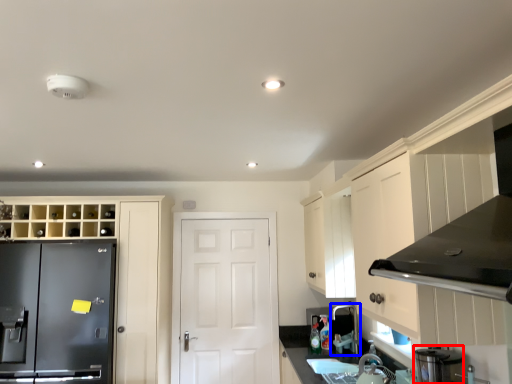
Question: Which object appears closest to the camera in this image, appliance (highlighted by a red box) or faucet (highlighted by a blue box)?

Choices:
 (A) appliance
 (B) faucet

Answer: (A)